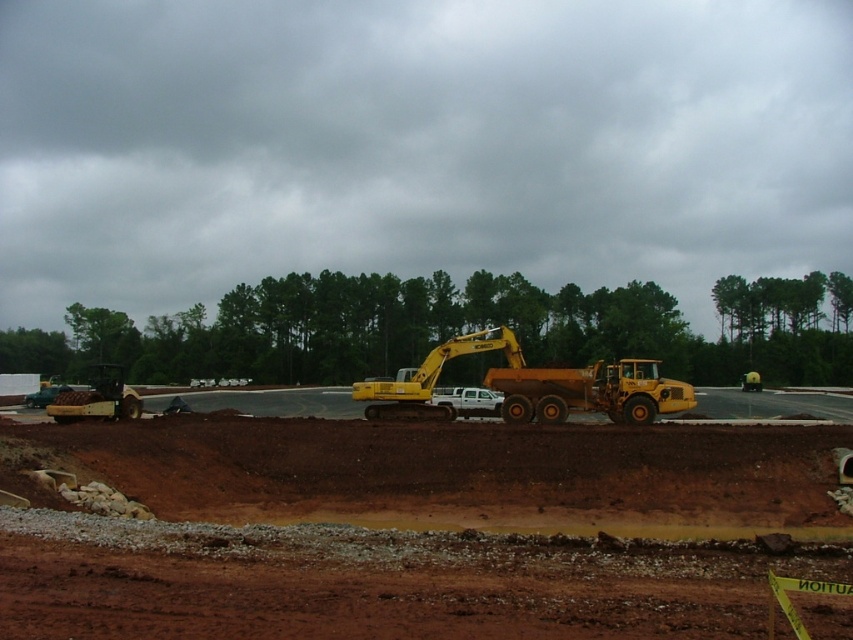
Which of these two, brown soil at center or yellow metallic excavator at center, stands shorter?

Standing shorter between the two is brown soil at center.

Is the position of brown soil at center more distant than that of yellow metallic excavator at center?

No, brown soil at center is closer to the viewer.

This screenshot has height=640, width=853. In order to click on brown soil at center in this screenshot , I will do `click(415, 529)`.